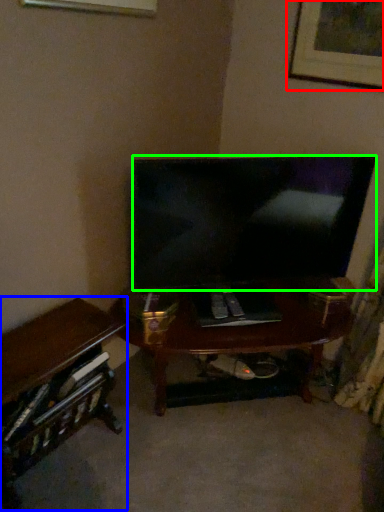
Question: Estimate the real-world distances between objects in this image. Which object is closer to picture frame (highlighted by a red box), desk (highlighted by a blue box) or television (highlighted by a green box)?

Choices:
 (A) desk
 (B) television

Answer: (B)